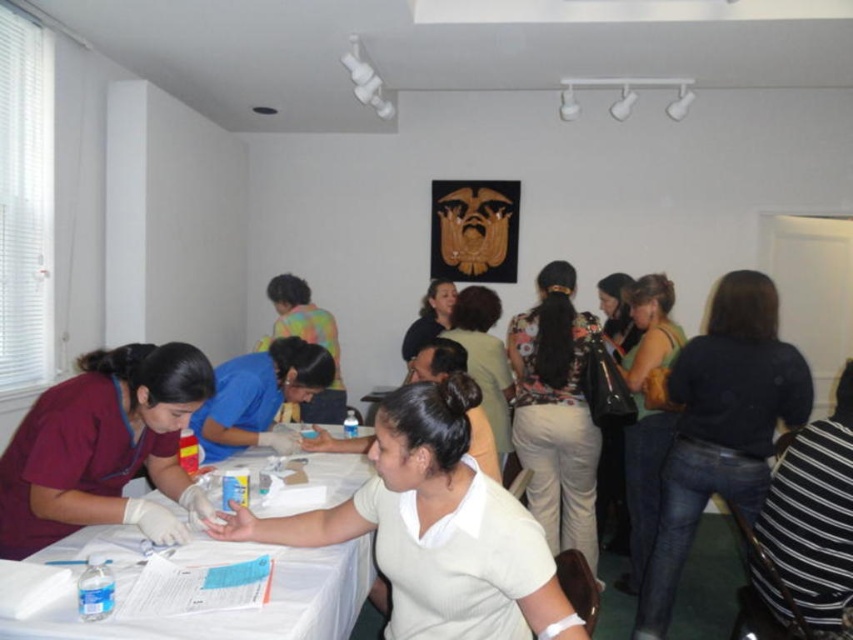
Question: Does white matte shirt at center appear over blue uniform shirt at center?

Choices:
 (A) yes
 (B) no

Answer: (B)

Question: Among these objects, which one is farthest from the camera?

Choices:
 (A) matte green tank top at center
 (B) white glossy table at center
 (C) white matte shirt at center

Answer: (B)

Question: Can you confirm if white paper table at center is positioned above floral print blouse at center?

Choices:
 (A) yes
 (B) no

Answer: (B)

Question: Which object is farther from the camera taking this photo?

Choices:
 (A) white glossy table at center
 (B) light beige sweater at center
 (C) maroon scrubs at left
 (D) matte green tank top at center

Answer: (B)

Question: From the image, what is the correct spatial relationship of white paper table at center in relation to blue uniform shirt at center?

Choices:
 (A) left
 (B) right

Answer: (B)

Question: Which object is the farthest from the matte green tank top at center?

Choices:
 (A) dark blue sweater at center
 (B) maroon scrubs at left
 (C) white paper table at center

Answer: (B)